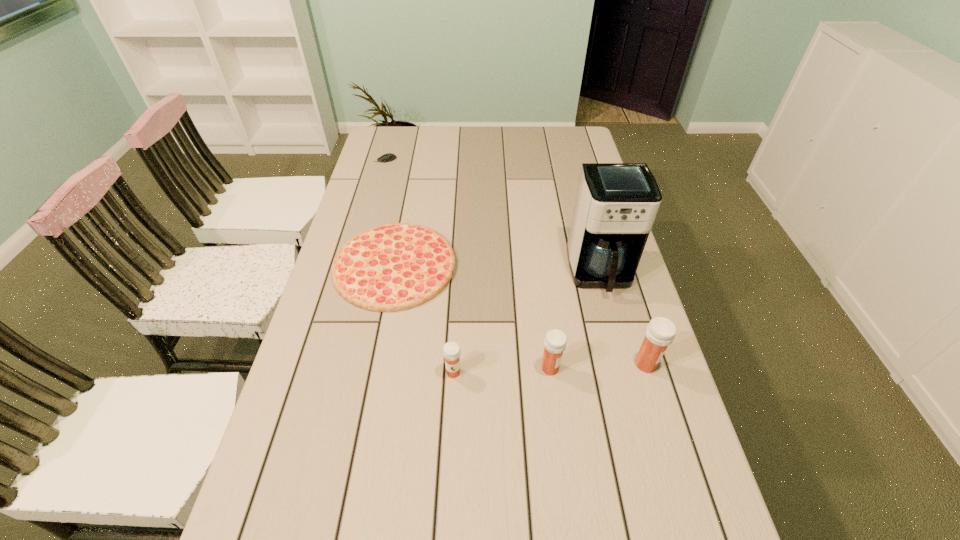
Find the location of a particular element. Image resolution: width=960 pixels, height=540 pixels. free space that satisfies the following two spatial constraints: 1. on the label side of the fourth shortest object; 2. on the label side of the shortest medicine is located at coordinates (551, 372).